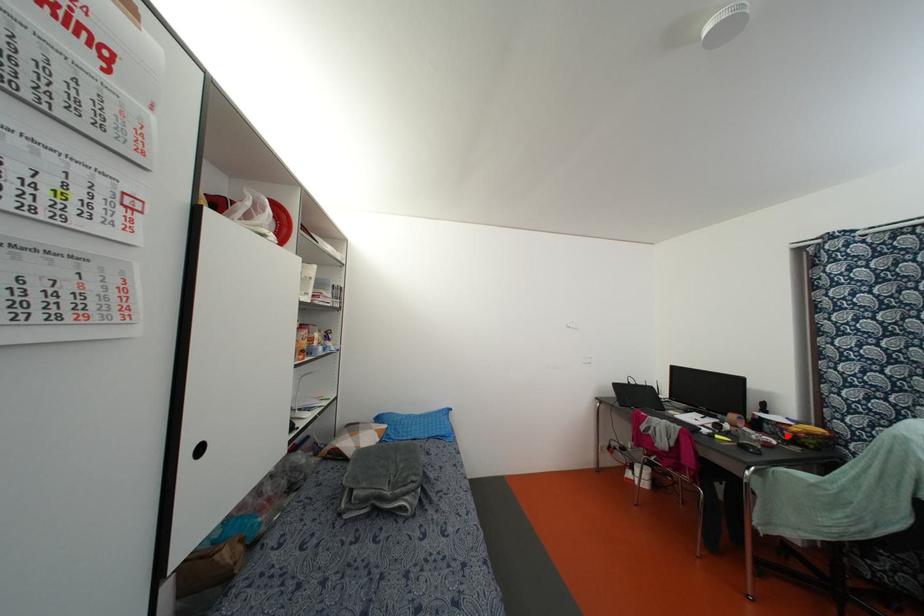
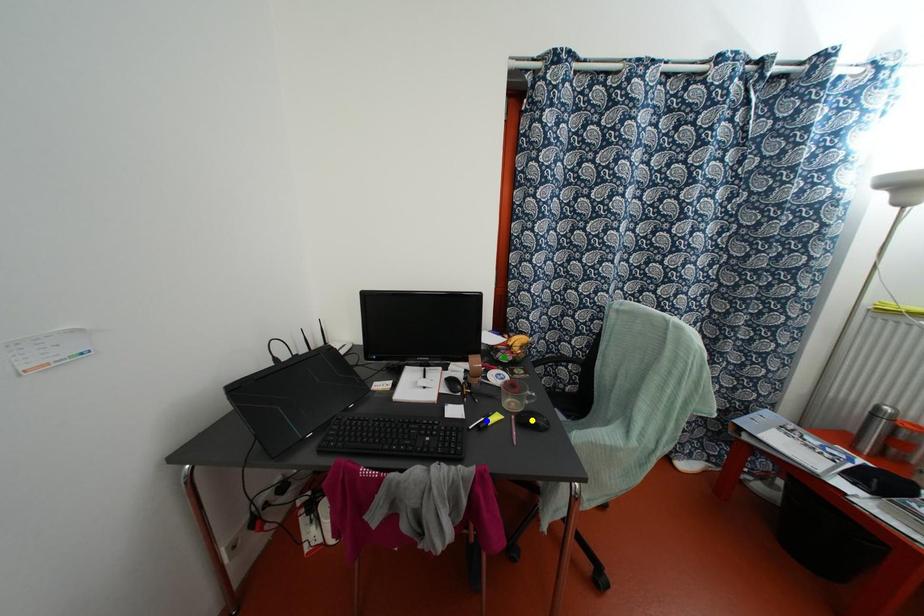
Question: I am providing you with two images of the same scene from different viewpoints. A red point is marked on the first image. You are given multiple points on the second image. Which mark in image 2 goes with the point in image 1?

Choices:
 (A) green point
 (B) yellow point
 (C) blue point

Answer: (A)